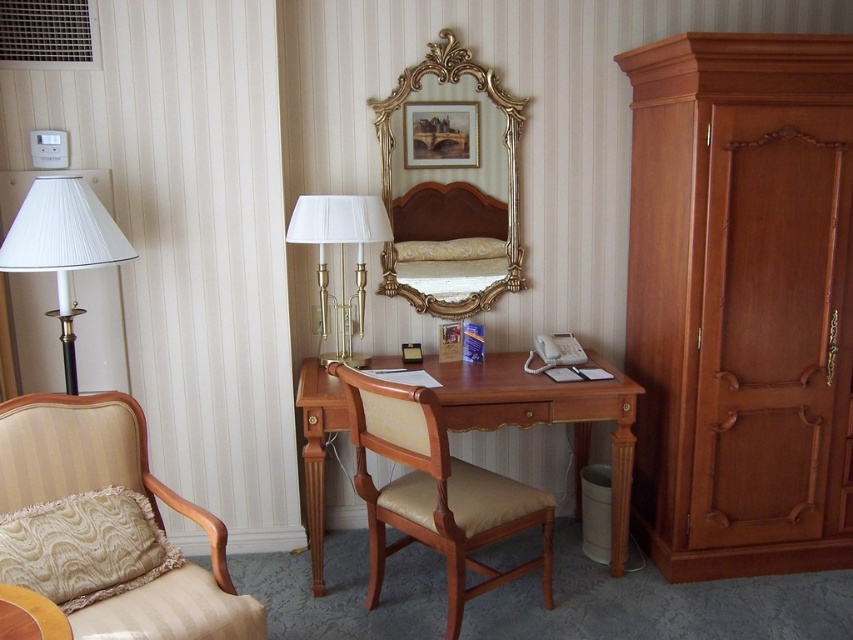
Question: Is white pleated fabric lampshade at left bigger than wooden side table at lower left?

Choices:
 (A) yes
 (B) no

Answer: (A)

Question: Does white pleated fabric lampshade at left appear on the left side of gold ornate picture frame at upper center?

Choices:
 (A) yes
 (B) no

Answer: (A)

Question: Does brown wood wardrobe at right have a greater width compared to beige fabric armchair at lower left?

Choices:
 (A) no
 (B) yes

Answer: (B)

Question: Which point is farther to the camera?

Choices:
 (A) (193, 589)
 (B) (27, 266)
 (C) (453, 301)
 (D) (328, 356)

Answer: (C)

Question: Which object is farther from the camera taking this photo?

Choices:
 (A) white pleated fabric lampshade at left
 (B) wooden desk at center

Answer: (B)

Question: Which of the following is the closest to the observer?

Choices:
 (A) gold ornate picture frame at upper center
 (B) wooden desk at center
 (C) brown wood wardrobe at right

Answer: (C)